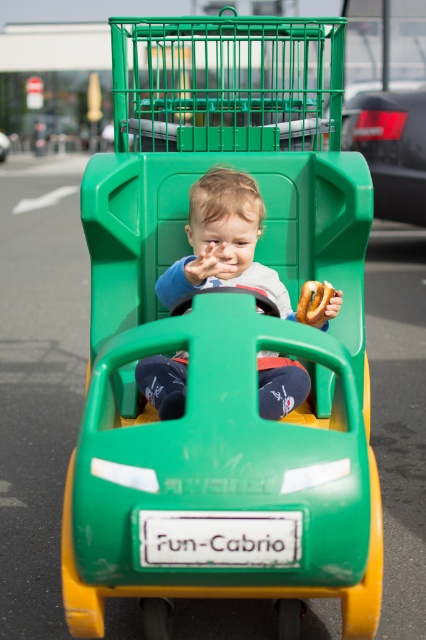
You are a parent trying to give your child a snack. You see the golden brown pretzel at center and the green matte car at center in the image. Which object is closer to the front of the image?

The green matte car at center is closer to the front of the image because the golden brown pretzel at center is behind it.

You are a photographer standing at the center of the scene. You want to take a photo that includes both the point at coordinates point (x=215, y=252) and the point at coordinates point (x=296, y=316). Based on their positions, which point should be closer to the camera lens?

Point (x=215, y=252) is in front of point (x=296, y=316), so it should be closer to the camera lens.